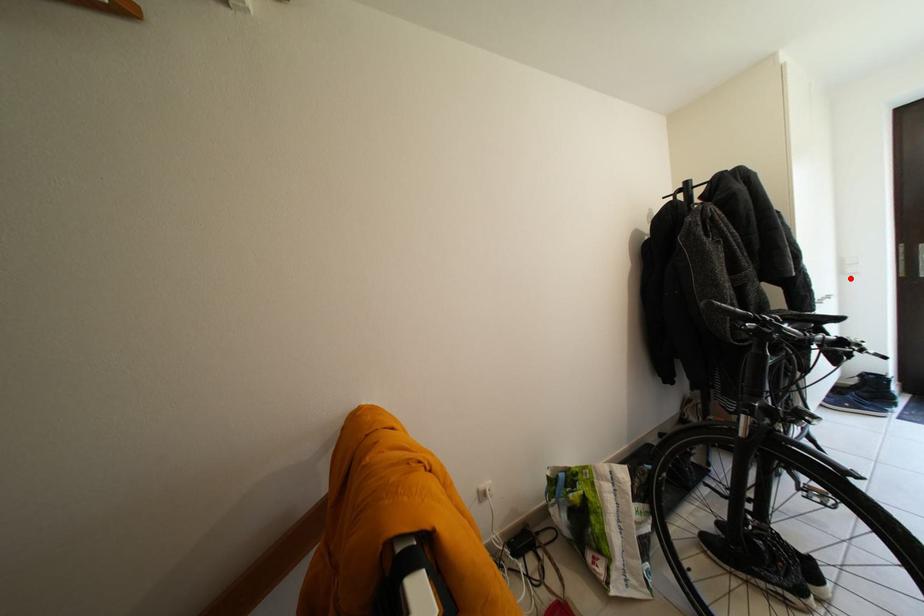
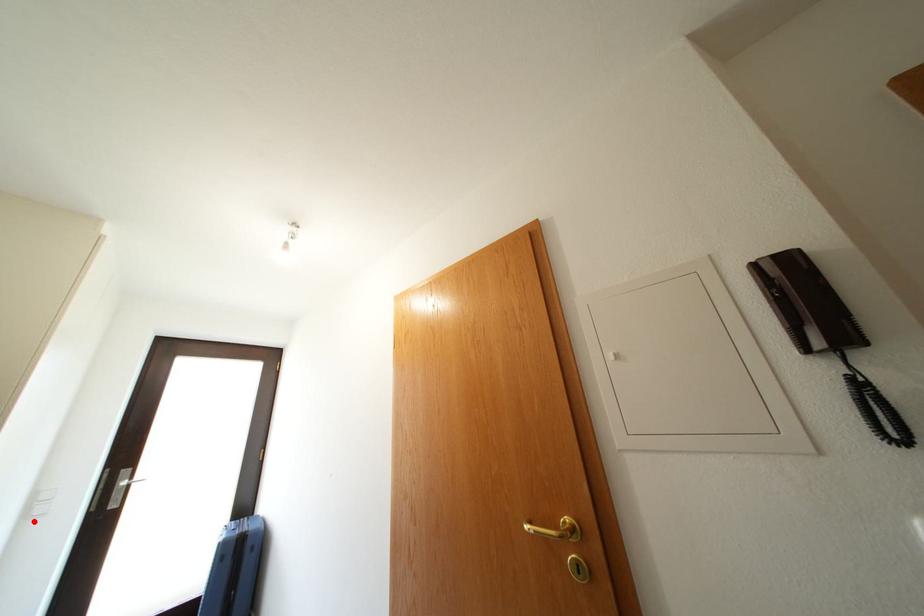
I am providing you with two images of the same scene from different viewpoints. A red point is marked on the first image and another point is marked on the second image. Is the marked point in image1 the same physical position as the marked point in image2?

Yes